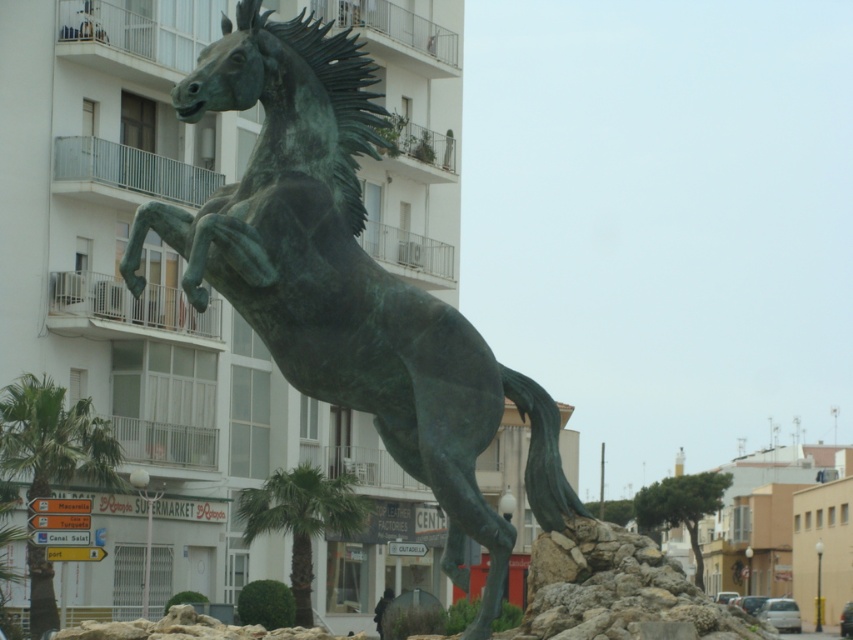
Question: Considering the real-world distances, which object is closest to the green patina bronze horse at center?

Choices:
 (A) green leafy palm tree at lower left
 (B) green leafy palm tree at center

Answer: (B)

Question: Does green patina bronze horse at center appear on the left side of green leafy palm tree at lower left?

Choices:
 (A) yes
 (B) no

Answer: (B)

Question: Among these points, which one is farthest from the camera?

Choices:
 (A) (310, 124)
 (B) (271, 499)
 (C) (26, 417)

Answer: (B)

Question: Which of these objects is positioned farthest from the green leafy palm tree at center?

Choices:
 (A) green patina bronze horse at center
 (B) green leafy palm tree at lower left

Answer: (A)

Question: Does green leafy palm tree at lower left appear under green leafy palm tree at center?

Choices:
 (A) yes
 (B) no

Answer: (B)

Question: Is green leafy palm tree at lower left thinner than green leafy palm tree at center?

Choices:
 (A) yes
 (B) no

Answer: (A)